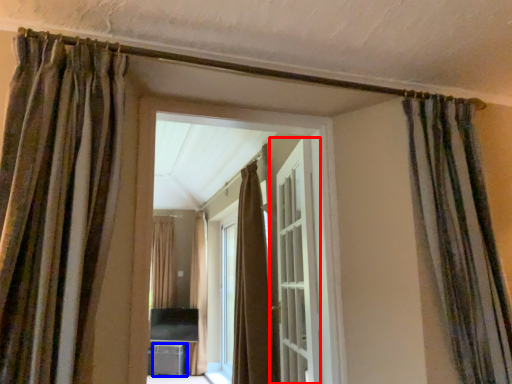
Question: Among these objects, which one is farthest to the camera, door (highlighted by a red box) or furniture (highlighted by a blue box)?

Choices:
 (A) door
 (B) furniture

Answer: (B)